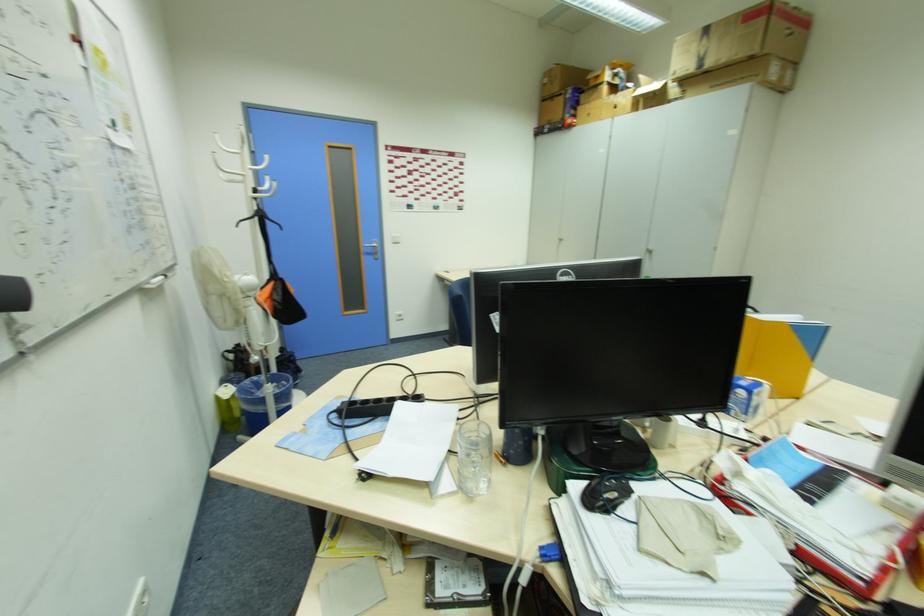
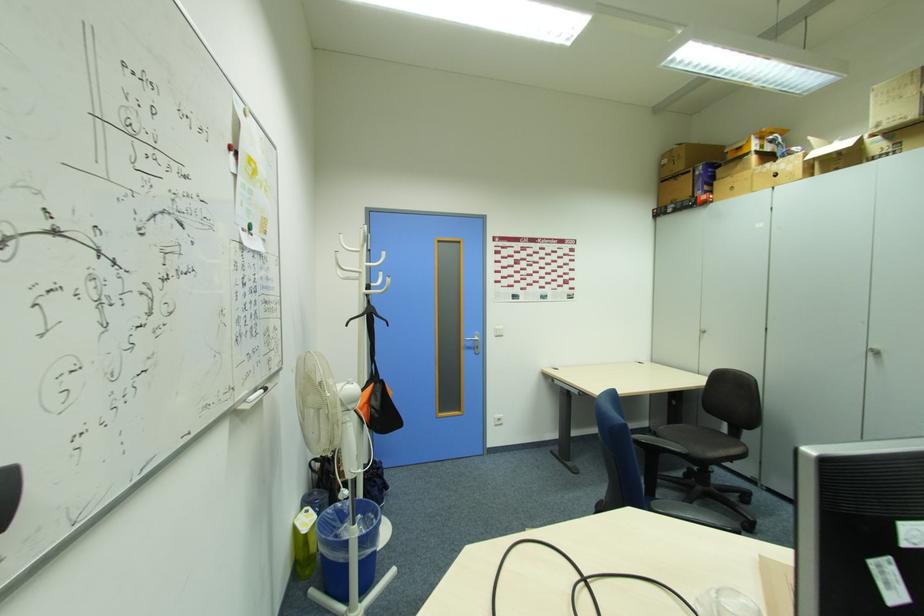
In the second image, find the point that corresponds to point (371, 252) in the first image.

(472, 346)